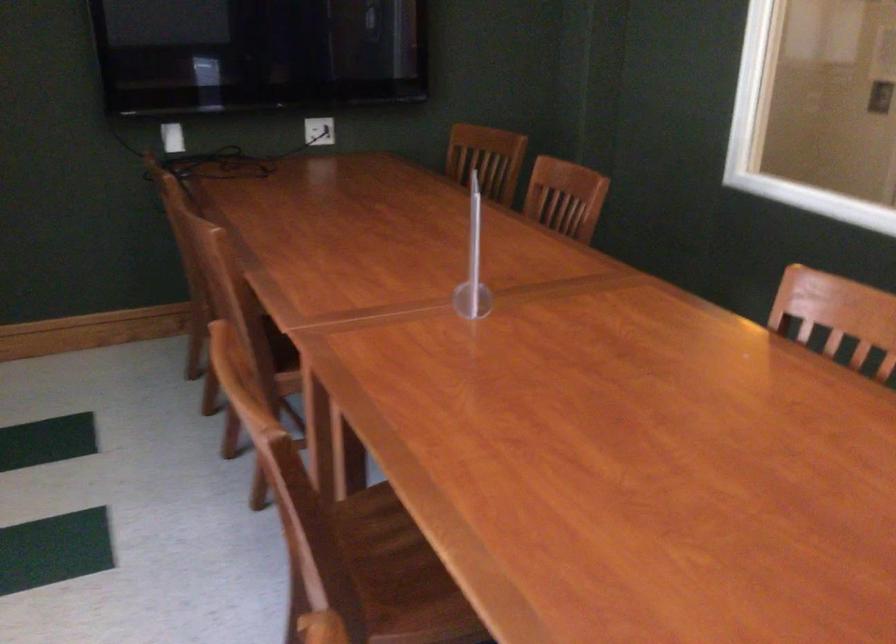
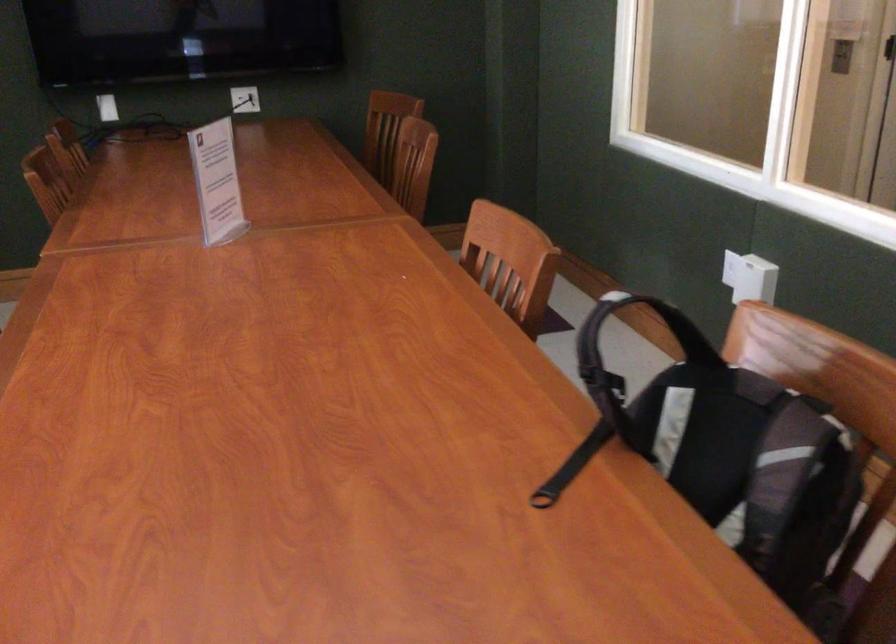
Locate, in the second image, the point that corresponds to pixel 321 134 in the first image.

(245, 99)